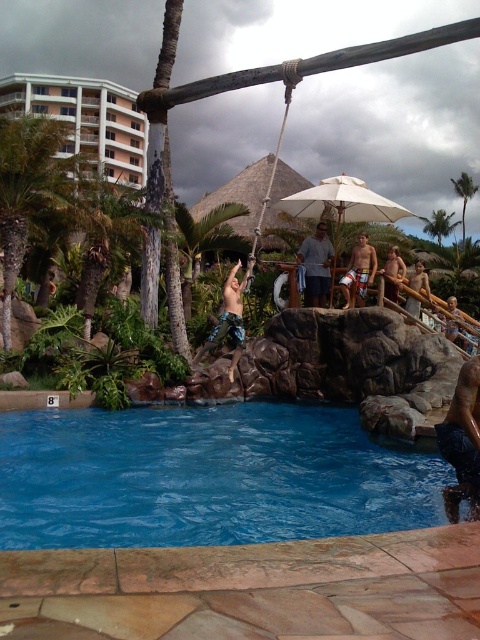
Question: Does smooth tan skin at lower right appear over white fabric umbrella at upper center?

Choices:
 (A) no
 (B) yes

Answer: (A)

Question: Which of the following is the closest to the observer?

Choices:
 (A) blue smooth water at lower center
 (B) green leafy palm tree at left
 (C) white glossy building at upper left

Answer: (A)

Question: Is blue smooth water at lower center to the left of green leafy palm tree at left from the viewer's perspective?

Choices:
 (A) yes
 (B) no

Answer: (B)

Question: Which of the following is the farthest from the observer?

Choices:
 (A) tan board shorts at upper right
 (B) green leafy palm tree at upper center

Answer: (B)

Question: Which object is positioned closest to the white glossy building at upper left?

Choices:
 (A) green leafy palm tree at upper right
 (B) smooth tan skin at lower right
 (C) tan board shorts at upper right

Answer: (C)

Question: Can you confirm if green leafy palm tree at left is positioned below green leafy palm tree at upper center?

Choices:
 (A) no
 (B) yes

Answer: (B)